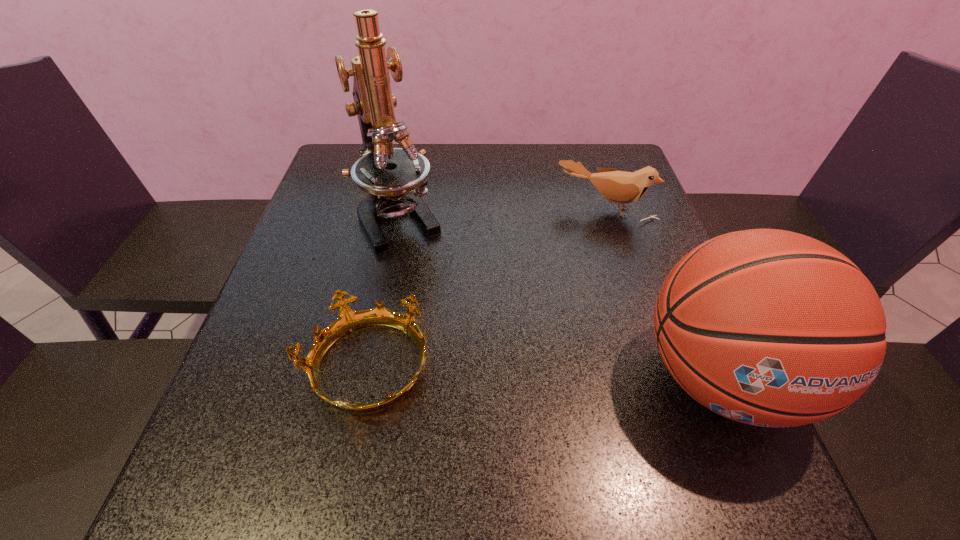
Image resolution: width=960 pixels, height=540 pixels. I want to click on free space on the desktop that is between the crown and the third shortest object and is positioned at the beak of the third tallest object, so click(537, 372).

In order to click on vacant spot on the desktop that is between the crown and the third shortest object and is positioned at the eyepiece of the tallest object in this screenshot , I will do `click(497, 371)`.